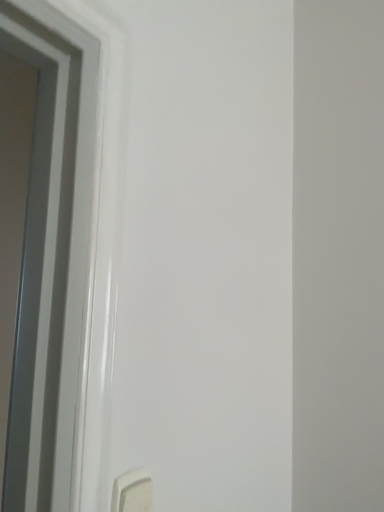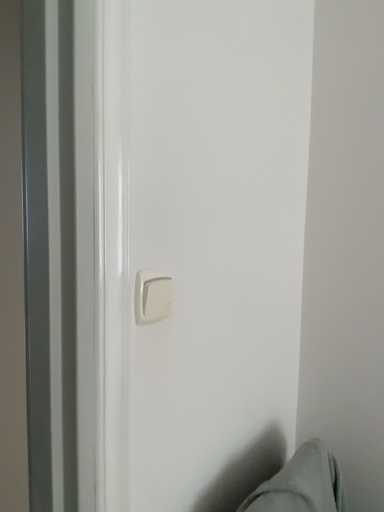
Question: Which way did the camera rotate in the video?

Choices:
 (A) rotated downward
 (B) rotated upward

Answer: (A)